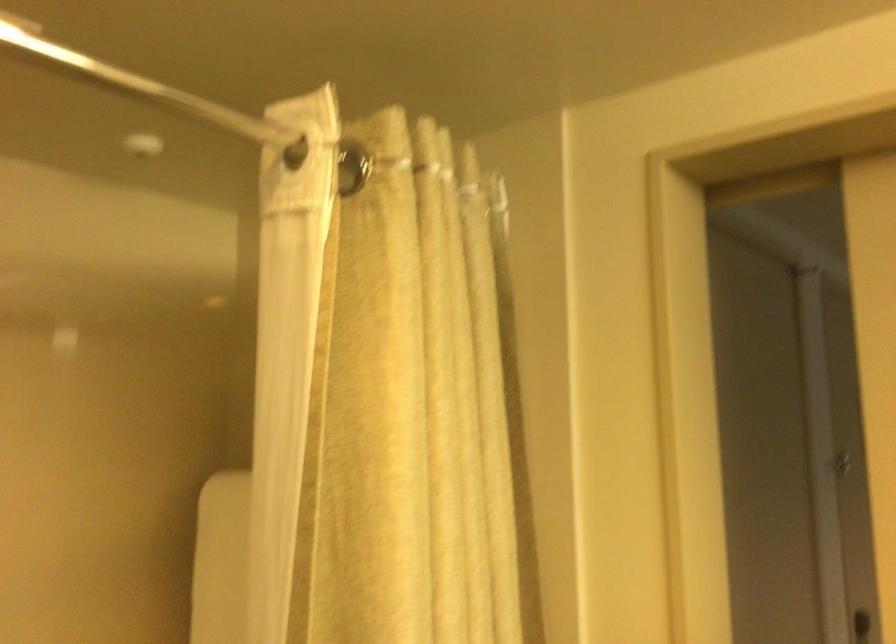
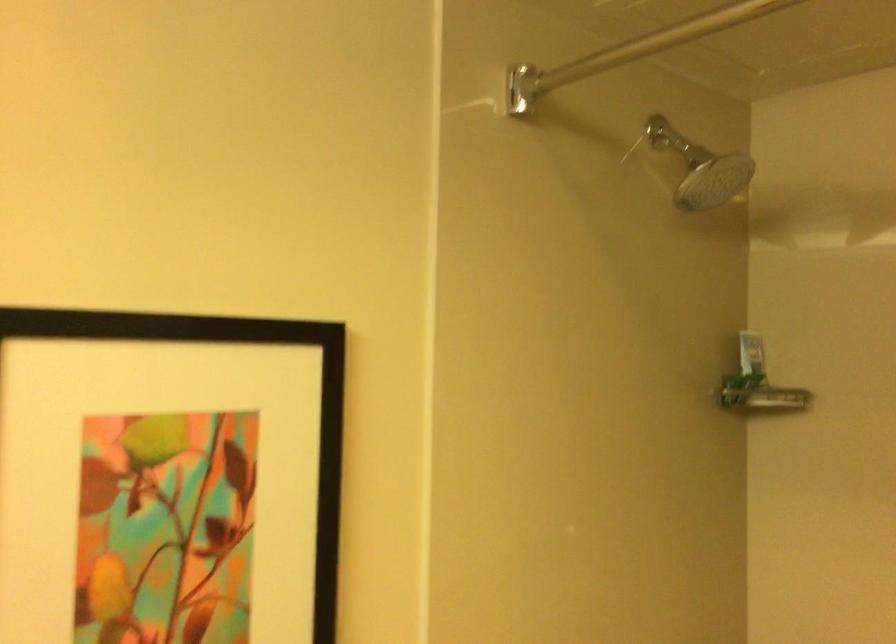
Question: The camera is either moving clockwise (left) or counter-clockwise (right) around the object. The first image is from the beginning of the video and the second image is from the end. Is the camera moving left or right when shooting the video?

Choices:
 (A) Left
 (B) Right

Answer: (B)